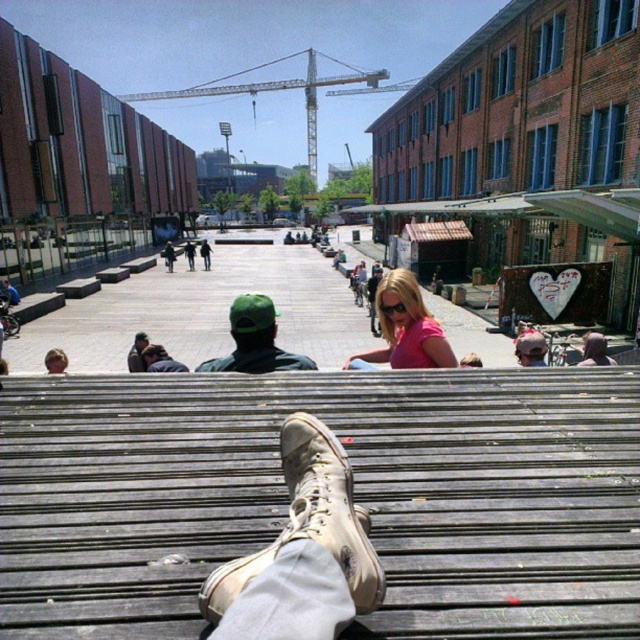
Is the position of wooden bench at center less distant than that of tan suede boot at center?

No.

Where is `wooden bench at center`? The height and width of the screenshot is (640, 640). wooden bench at center is located at coordinates (355, 497).

You are a GUI agent. You are given a task and a screenshot of the screen. Output one action in this format:
    pyautogui.click(x=<x>, y=<y>)
    Task: Click on the wooden bench at center
    This screenshot has width=640, height=640.
    Given the screenshot: What is the action you would take?
    pyautogui.click(x=355, y=497)

The image size is (640, 640). In order to click on wooden bench at center in this screenshot , I will do `click(355, 497)`.

Between point (218, 364) and point (51, 355), which one is positioned behind?

Positioned behind is point (51, 355).

Is green cap at center wider than matte black jacket at lower left?

Indeed, green cap at center has a greater width compared to matte black jacket at lower left.

Is point (248, 301) more distant than point (56, 364)?

No, (248, 301) is in front of (56, 364).

You are a GUI agent. You are given a task and a screenshot of the screen. Output one action in this format:
    pyautogui.click(x=<x>, y=<y>)
    Task: Click on the green cap at center
    Image resolution: width=640 pixels, height=640 pixels.
    Given the screenshot: What is the action you would take?
    pyautogui.click(x=256, y=340)

Is wooden bench at center to the left of matte black jacket at lower left from the viewer's perspective?

In fact, wooden bench at center is to the right of matte black jacket at lower left.

Locate an element on the screen. This screenshot has height=640, width=640. wooden bench at center is located at coordinates (355, 497).

Identify the location of wooden bench at center. The image size is (640, 640). (355, 497).

Where is `wooden bench at center`? The image size is (640, 640). wooden bench at center is located at coordinates (355, 497).